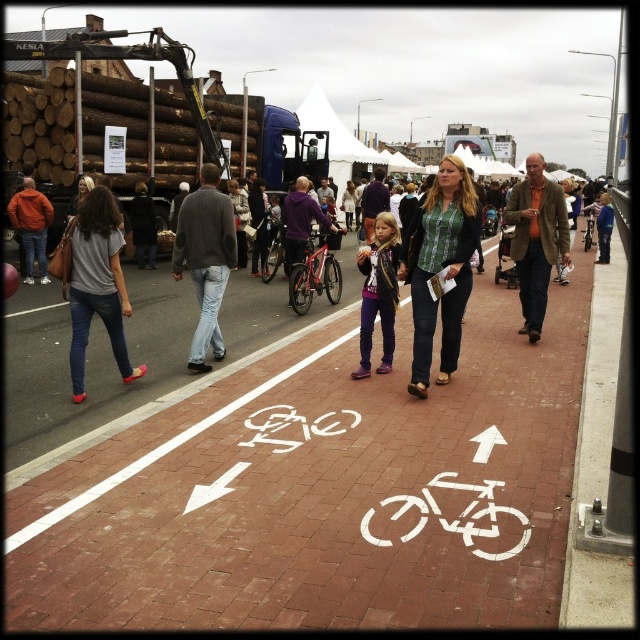
You are a delivery person trying to navigate through the busy urban scene. You need to deliver a package to the crane near the truck. You see the brick pavement at center and the green plaid shirt at center. Which object is closer to the crane?

The brick pavement at center is closer to the crane because it is shorter than the green plaid shirt at center, which would place it nearer in the scene.

You are standing at the origin point in the image. Where is the brick pavement at center located in terms of its 2D coordinates?

The brick pavement at center is located at the 2D coordinates of point [323,493].